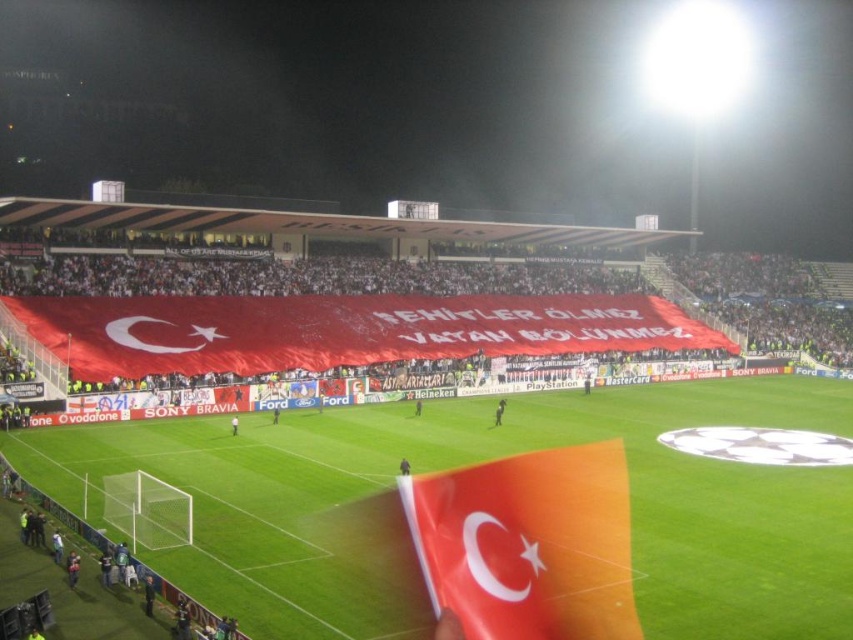
You are a photographer at the stadium and want to capture both the matte orange flag at lower right and the dark blue fabric at center in the same frame. Which flag should you focus on first to ensure both are visible?

The matte orange flag at lower right is bigger than the dark blue fabric at center, so focusing on the matte orange flag at lower right first will ensure both are visible in the frame.

You are a photographer at the UEFA Champions League match. You want to capture a photo of the green grass football field at center and the matte orange flag at lower right. Based on their positions, which object is located to the right side of the other?

The green grass football field at center is to the right of the matte orange flag at lower right.

You are standing at point A and want to walk to point B in the football stadium. The coordinates of point A are point (595, 504) and point B are point (401, 474). According to the image, which direction should you move to reach point B from point A?

To reach point B from point A, you should move backward since point A is in front of point B.